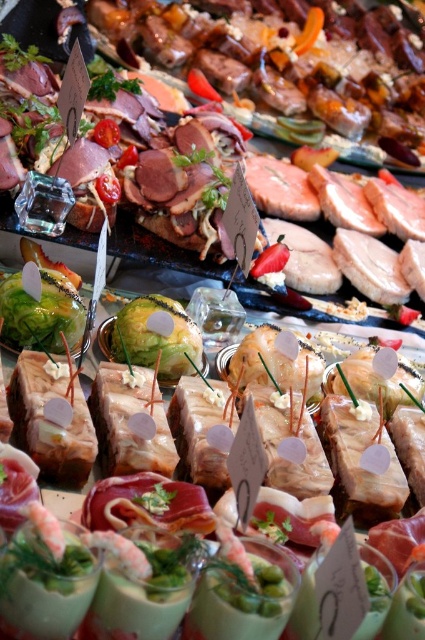
You are a food photographer standing 2 meters away from the shiny brown meat at upper center. Can you capture the entire scene in one shot without moving closer?

The shiny brown meat at upper center is 2.47 meters away from the camera. Since you are standing 2 meters away, you are closer than the required distance to capture the entire scene, so you can take the photo without moving closer.

Based on the photo, you are standing in front of the food display and want to pick up both items. Which item should you reach for first, the one at point (342, 115) or the one at point (201, 342)?

You should reach for the item at point (201, 342) first because it is closer to you than the one at point (342, 115), which is further away.